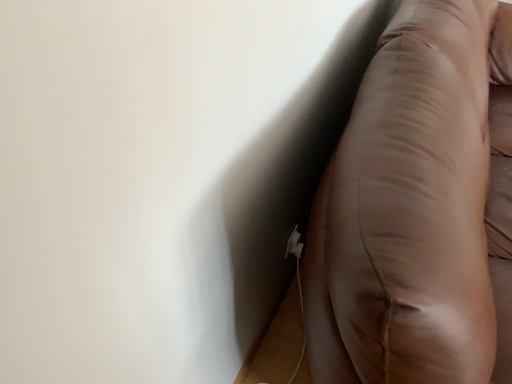
Question: Should I look upward or downward to see brown leather couch at right?

Choices:
 (A) up
 (B) down

Answer: (A)